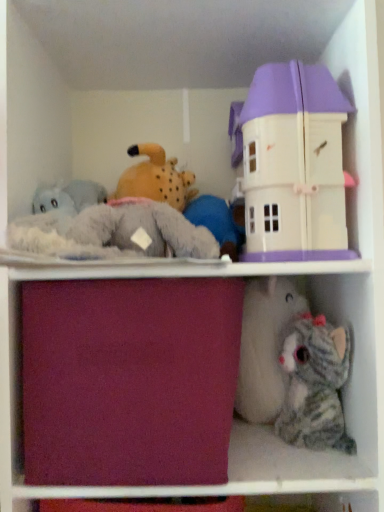
Question: Can you confirm if striped plush cat at lower right, the second toy from the top, is thinner than pastel purple plastic dollhouse at upper right, placed as the 2th toy when sorted from bottom to top?

Choices:
 (A) yes
 (B) no

Answer: (B)

Question: From the image's perspective, is striped plush cat at lower right, marked as the 1th toy in a bottom-to-top arrangement, above pastel purple plastic dollhouse at upper right, placed as the 2th toy when sorted from bottom to top?

Choices:
 (A) yes
 (B) no

Answer: (B)

Question: Is striped plush cat at lower right, the second toy from the top, in contact with pastel purple plastic dollhouse at upper right, marked as the 1th toy in a top-to-bottom arrangement?

Choices:
 (A) yes
 (B) no

Answer: (B)

Question: From a real-world perspective, is striped plush cat at lower right, marked as the 1th toy in a bottom-to-top arrangement, under pastel purple plastic dollhouse at upper right, marked as the 1th toy in a top-to-bottom arrangement?

Choices:
 (A) no
 (B) yes

Answer: (B)

Question: From the image's perspective, is striped plush cat at lower right, marked as the 1th toy in a bottom-to-top arrangement, below pastel purple plastic dollhouse at upper right, marked as the 1th toy in a top-to-bottom arrangement?

Choices:
 (A) yes
 (B) no

Answer: (A)

Question: In terms of width, does pastel purple plastic dollhouse at upper right, marked as the 1th toy in a top-to-bottom arrangement, look wider or thinner when compared to burgundy fabric drawer at center?

Choices:
 (A) wide
 (B) thin

Answer: (B)

Question: From a real-world perspective, is pastel purple plastic dollhouse at upper right, marked as the 1th toy in a top-to-bottom arrangement, above or below burgundy fabric drawer at center?

Choices:
 (A) above
 (B) below

Answer: (A)

Question: Based on their positions, is pastel purple plastic dollhouse at upper right, placed as the 2th toy when sorted from bottom to top, located to the left or right of burgundy fabric drawer at center?

Choices:
 (A) right
 (B) left

Answer: (A)

Question: Considering their positions, is pastel purple plastic dollhouse at upper right, marked as the 1th toy in a top-to-bottom arrangement, located in front of or behind burgundy fabric drawer at center?

Choices:
 (A) behind
 (B) front

Answer: (A)

Question: In terms of width, does pastel purple plastic dollhouse at upper right, placed as the 2th toy when sorted from bottom to top, look wider or thinner when compared to striped plush cat at lower right, the second toy from the top?

Choices:
 (A) thin
 (B) wide

Answer: (A)

Question: From a real-world perspective, is pastel purple plastic dollhouse at upper right, placed as the 2th toy when sorted from bottom to top, positioned above or below striped plush cat at lower right, marked as the 1th toy in a bottom-to-top arrangement?

Choices:
 (A) above
 (B) below

Answer: (A)

Question: Based on their sizes in the image, would you say pastel purple plastic dollhouse at upper right, marked as the 1th toy in a top-to-bottom arrangement, is bigger or smaller than striped plush cat at lower right, marked as the 1th toy in a bottom-to-top arrangement?

Choices:
 (A) small
 (B) big

Answer: (B)

Question: Is pastel purple plastic dollhouse at upper right, placed as the 2th toy when sorted from bottom to top, in front of or behind striped plush cat at lower right, the second toy from the top, in the image?

Choices:
 (A) front
 (B) behind

Answer: (A)

Question: Is burgundy fabric drawer at center taller or shorter than pastel purple plastic dollhouse at upper right, marked as the 1th toy in a top-to-bottom arrangement?

Choices:
 (A) tall
 (B) short

Answer: (B)

Question: Is point (94, 414) positioned closer to the camera than point (296, 252)?

Choices:
 (A) farther
 (B) closer

Answer: (B)